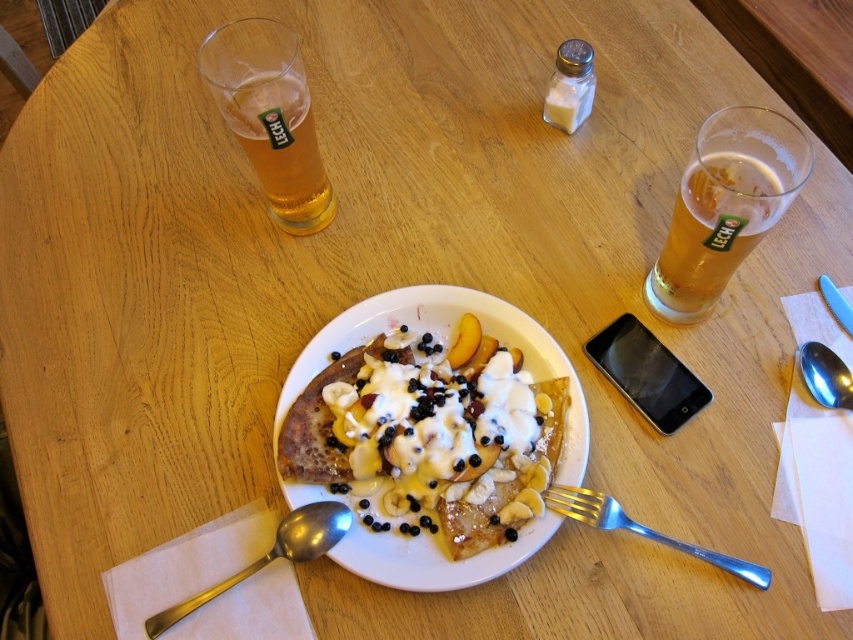
Can you confirm if golden crispy crepe topped with cream, fruit, and blueberries at center is positioned to the left of satin silver spoon at lower left?

In fact, golden crispy crepe topped with cream, fruit, and blueberries at center is to the right of satin silver spoon at lower left.

Can you confirm if golden crispy crepe topped with cream, fruit, and blueberries at center is positioned to the right of satin silver spoon at lower left?

Correct, you'll find golden crispy crepe topped with cream, fruit, and blueberries at center to the right of satin silver spoon at lower left.

Measure the distance between golden crispy crepe topped with cream, fruit, and blueberries at center and camera.

They are 18.14 inches apart.

I want to click on golden crispy crepe topped with cream, fruit, and blueberries at center, so click(x=427, y=436).

How distant is golden crispy crepe topped with cream, fruit, and blueberries at center from silver metallic fork at lower right?

They are 3.59 inches apart.

Can you confirm if golden crispy crepe topped with cream, fruit, and blueberries at center is positioned above silver metallic fork at lower right?

Yes.

Where is `golden crispy crepe topped with cream, fruit, and blueberries at center`? The width and height of the screenshot is (853, 640). golden crispy crepe topped with cream, fruit, and blueberries at center is located at coordinates (427, 436).

Which is in front, point (283, 220) or point (289, 520)?

Point (289, 520) is in front.

Can you confirm if golden amber liquid at upper left is thinner than satin silver spoon at lower left?

Correct, golden amber liquid at upper left's width is less than satin silver spoon at lower left's.

The height and width of the screenshot is (640, 853). I want to click on golden amber liquid at upper left, so click(270, 116).

Where is `golden amber liquid at upper left`? golden amber liquid at upper left is located at coordinates (270, 116).